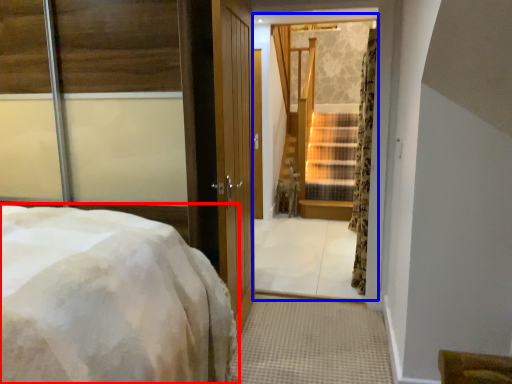
Question: Among these objects, which one is farthest to the camera, bed (highlighted by a red box) or window (highlighted by a blue box)?

Choices:
 (A) bed
 (B) window

Answer: (B)